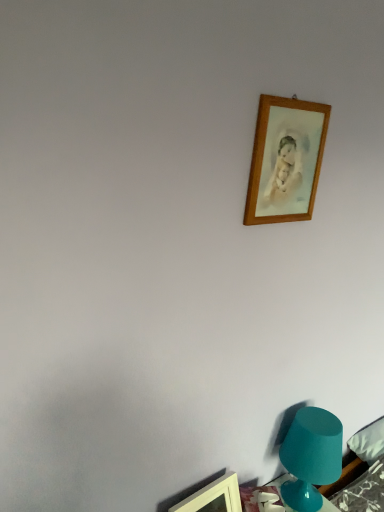
Question: From the image's perspective, is teal glass lamp at lower right located beneath wooden picture frame at upper right, which ranks as the 1th picture frame in bottom-to-top order?

Choices:
 (A) no
 (B) yes

Answer: (A)

Question: From a real-world perspective, is teal glass lamp at lower right physically below wooden picture frame at upper right, which is the 2th picture frame from top to bottom?

Choices:
 (A) no
 (B) yes

Answer: (A)

Question: Is wooden picture frame at upper right, positioned as the 2th picture frame in right-to-left order, located within teal glass lamp at lower right?

Choices:
 (A) no
 (B) yes

Answer: (A)

Question: Considering the relative sizes of teal glass lamp at lower right and wooden picture frame at upper right, placed as the 1th picture frame when sorted from left to right, in the image provided, is teal glass lamp at lower right shorter than wooden picture frame at upper right, placed as the 1th picture frame when sorted from left to right,?

Choices:
 (A) no
 (B) yes

Answer: (A)

Question: Is teal glass lamp at lower right further to camera compared to wooden picture frame at upper right, placed as the 1th picture frame when sorted from left to right?

Choices:
 (A) no
 (B) yes

Answer: (B)

Question: Considering the relative sizes of teal glass lamp at lower right and wooden picture frame at upper right, which ranks as the 1th picture frame in bottom-to-top order, in the image provided, is teal glass lamp at lower right bigger than wooden picture frame at upper right, which ranks as the 1th picture frame in bottom-to-top order,?

Choices:
 (A) yes
 (B) no

Answer: (A)

Question: Can you confirm if wooden picture frame at upper right, which ranks as the 1th picture frame in bottom-to-top order, is bigger than teal glass lamp at lower right?

Choices:
 (A) no
 (B) yes

Answer: (A)

Question: Could teal glass lamp at lower right be considered to be inside wooden picture frame at upper right, which is the 2th picture frame from top to bottom?

Choices:
 (A) no
 (B) yes

Answer: (A)

Question: Is wooden picture frame at upper right, positioned as the 2th picture frame in right-to-left order, wider than teal glass lamp at lower right?

Choices:
 (A) no
 (B) yes

Answer: (A)

Question: From a real-world perspective, does wooden picture frame at upper right, which is the 2th picture frame from top to bottom, stand above teal glass lamp at lower right?

Choices:
 (A) yes
 (B) no

Answer: (B)

Question: Is wooden picture frame at upper right, which ranks as the 1th picture frame in bottom-to-top order, oriented away from teal glass lamp at lower right?

Choices:
 (A) no
 (B) yes

Answer: (A)

Question: From the image's perspective, is wooden picture frame at upper right, positioned as the 2th picture frame in right-to-left order, beneath teal glass lamp at lower right?

Choices:
 (A) yes
 (B) no

Answer: (A)

Question: Is wooden picture frame at upper right, which ranks as the 1th picture frame in right-to-left order, positioned with its back to wooden picture frame at upper right, placed as the 1th picture frame when sorted from left to right?

Choices:
 (A) yes
 (B) no

Answer: (B)